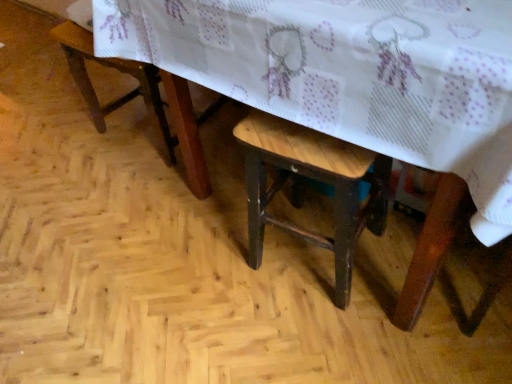
This screenshot has width=512, height=384. Find the location of `free area in between wooden stool at lower left and wooden table at center`. free area in between wooden stool at lower left and wooden table at center is located at coordinates (144, 161).